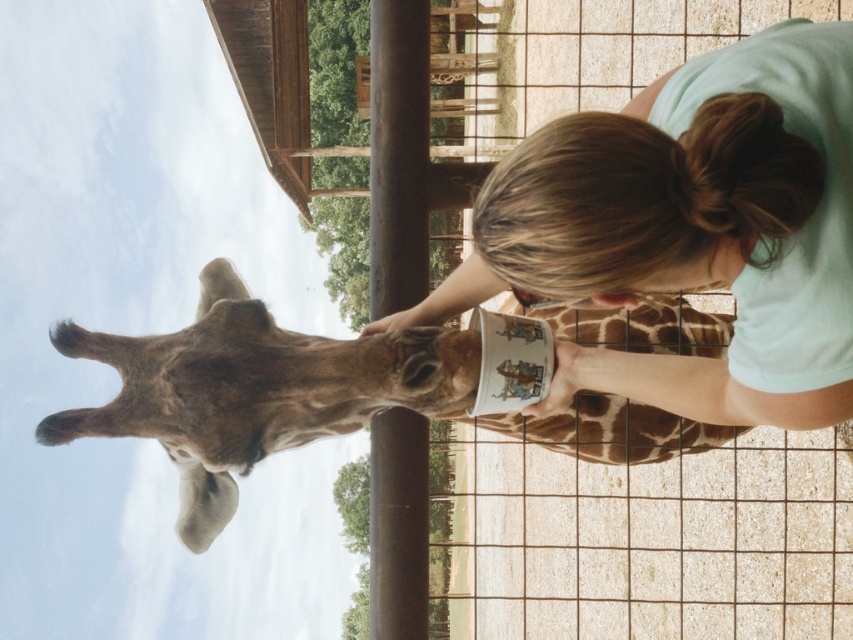
Question: Which point is farther from the camera taking this photo?

Choices:
 (A) (132, 403)
 (B) (668, 99)

Answer: (B)

Question: Does light blue t-shirt at center appear under brown spotted giraffe at center?

Choices:
 (A) yes
 (B) no

Answer: (B)

Question: Is light blue t-shirt at center in front of brown spotted giraffe at center?

Choices:
 (A) yes
 (B) no

Answer: (A)

Question: Does light blue t-shirt at center have a larger size compared to brown spotted giraffe at center?

Choices:
 (A) yes
 (B) no

Answer: (A)

Question: Which point is closer to the camera taking this photo?

Choices:
 (A) (212, 456)
 (B) (540, 240)

Answer: (B)

Question: Among these objects, which one is nearest to the camera?

Choices:
 (A) light blue t-shirt at center
 (B) brown spotted giraffe at center

Answer: (A)